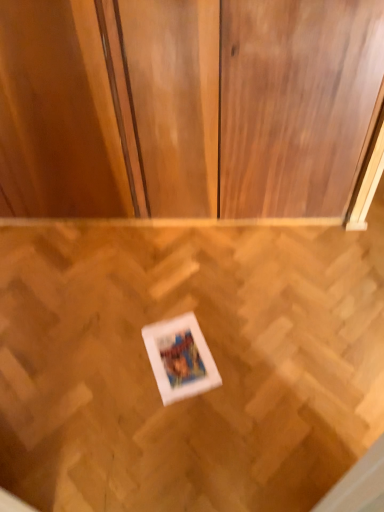
Locate an element on the screen. blank space situated above white matte picture frame at center (from a real-world perspective) is located at coordinates (177, 353).